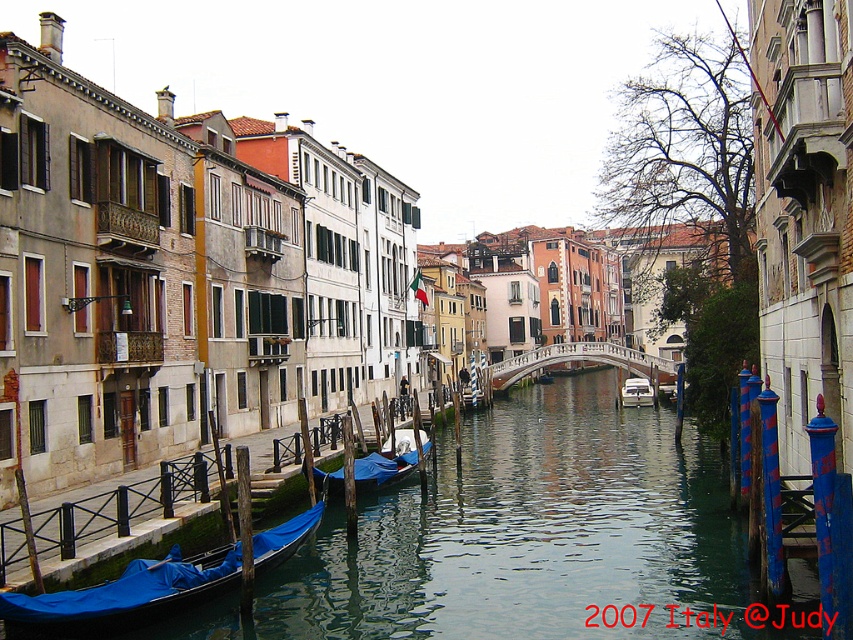
Is blue fabric-covered gondola at lower left thinner than blue fabric-covered gondola at center?

Indeed, blue fabric-covered gondola at lower left has a lesser width compared to blue fabric-covered gondola at center.

Who is lower down, blue fabric-covered gondola at lower left or blue fabric-covered gondola at center?

blue fabric-covered gondola at lower left is below.

Does point (302, 522) come in front of point (212, 531)?

No, (302, 522) is behind (212, 531).

Identify the location of blue fabric-covered gondola at lower left. (126, 595).

From the picture: Between white stone bridge at center and white glossy boat at center, which one appears on the right side from the viewer's perspective?

white glossy boat at center

Can you confirm if white stone bridge at center is positioned below white glossy boat at center?

No, white stone bridge at center is not below white glossy boat at center.

Is point (540, 358) in front of point (648, 401)?

No, it is not.

Image resolution: width=853 pixels, height=640 pixels. I want to click on white stone bridge at center, so click(x=581, y=360).

Is point (125, 611) positioned in front of point (361, 467)?

That is True.

Which is in front, point (15, 616) or point (390, 476)?

Point (15, 616)

The image size is (853, 640). What are the coordinates of `blue fabric-covered gondola at lower left` in the screenshot? It's located at (126, 595).